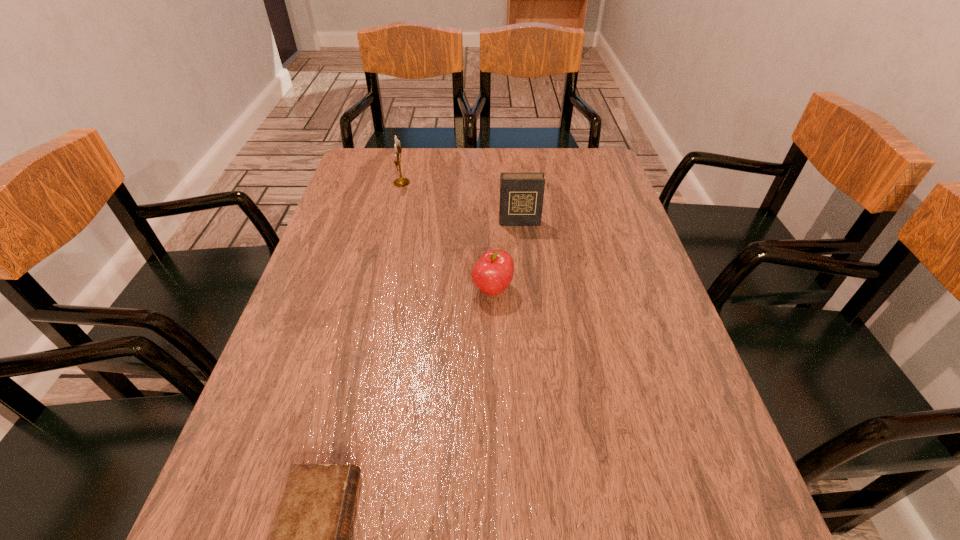
Locate an element on the screen. The width and height of the screenshot is (960, 540). candelabrum is located at coordinates tap(400, 182).

The width and height of the screenshot is (960, 540). I want to click on the third nearest object, so click(521, 194).

Identify the location of the taller diary. (521, 194).

Where is `the second shortest object`? This screenshot has width=960, height=540. the second shortest object is located at coordinates (493, 272).

This screenshot has height=540, width=960. In order to click on apple in this screenshot , I will do `click(493, 272)`.

This screenshot has height=540, width=960. In order to click on vacant region located on the right of the candelabrum in this screenshot , I will do `click(499, 183)`.

Find the location of a particular element. Image resolution: width=960 pixels, height=540 pixels. blank space located on the front cover of the second farthest object is located at coordinates (530, 320).

Identify the location of blank space located on the left of the second shortest object. The image size is (960, 540). (341, 289).

Locate an element on the screen. This screenshot has width=960, height=540. object located at the far edge is located at coordinates (400, 182).

At what (x,y) coordinates should I click in order to perform the action: click on object located in the left edge section of the desktop. Please return your answer as a coordinate pair (x, y). This screenshot has width=960, height=540. Looking at the image, I should click on (400, 182).